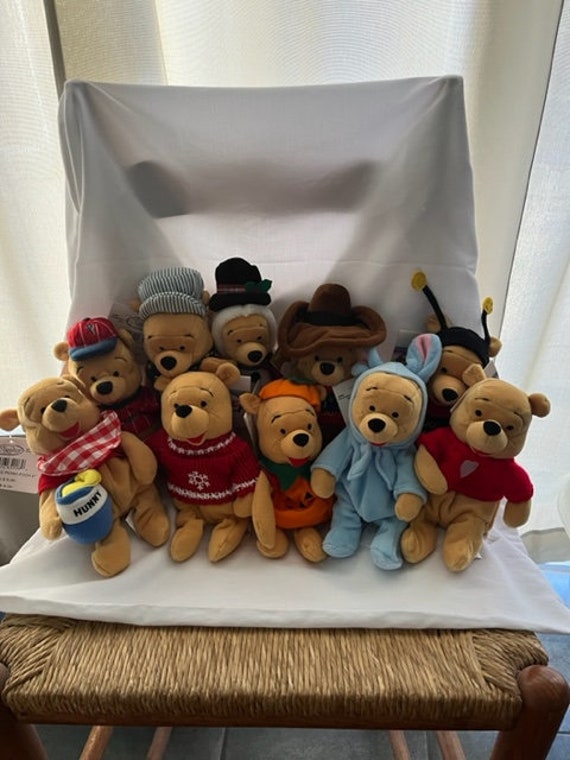
Identify the location of winnie the pooh doll. The image size is (570, 760). (62, 416), (188, 418), (107, 371), (169, 344), (246, 340), (292, 432), (328, 361), (384, 416), (492, 426), (447, 375).